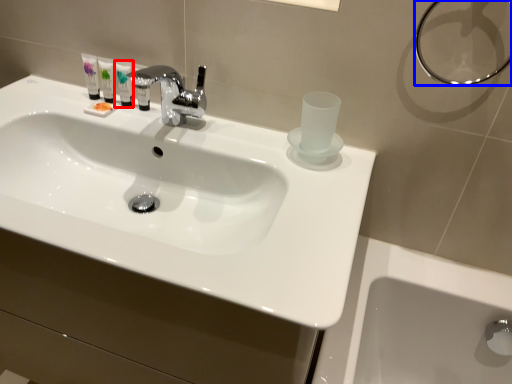
Question: Which point is further to the camera, mouthwash (highlighted by a red box) or shower (highlighted by a blue box)?

Choices:
 (A) mouthwash
 (B) shower

Answer: (A)